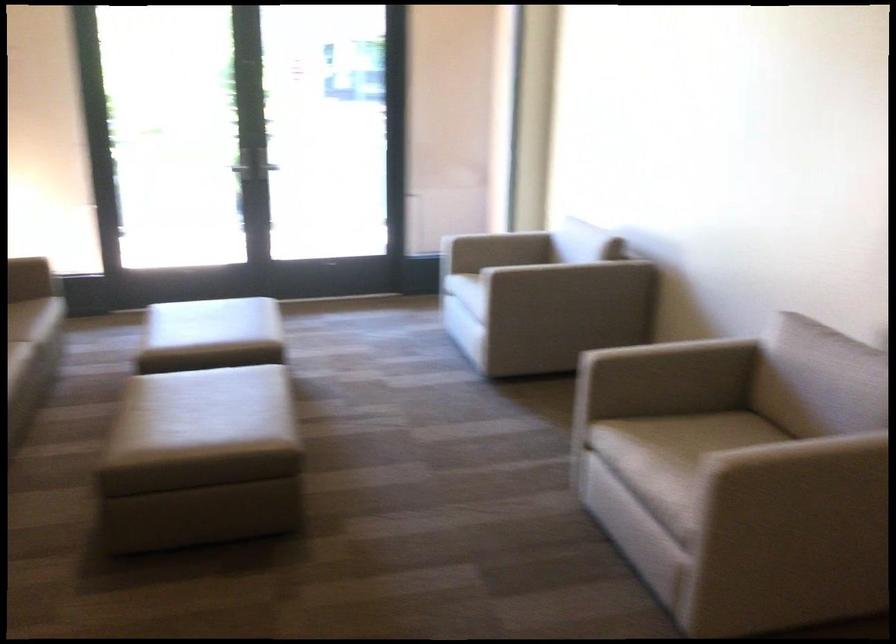
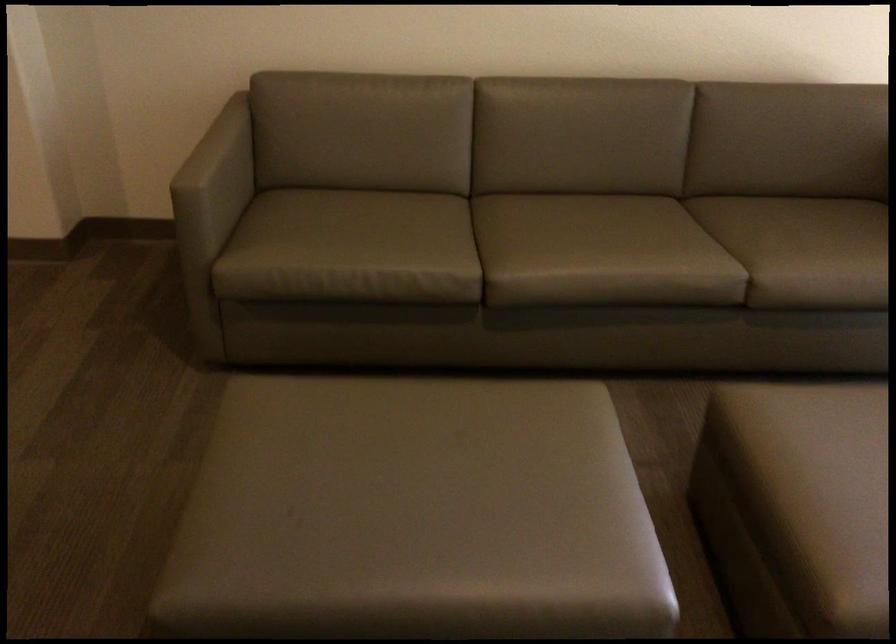
Locate, in the second image, the point that corresponds to point 185,411 in the first image.

(407, 480)